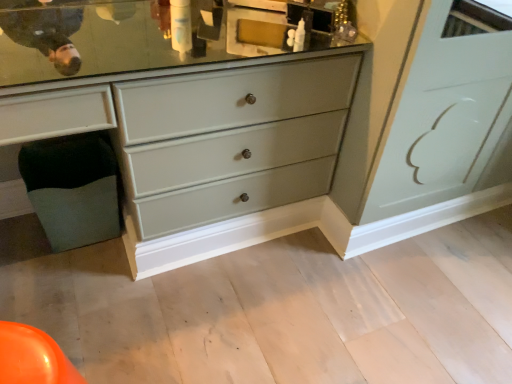
I want to click on satin gray dresser at center, so click(x=295, y=135).

What do you see at coordinates (295, 135) in the screenshot? I see `satin gray dresser at center` at bounding box center [295, 135].

The height and width of the screenshot is (384, 512). Find the location of `satin gray dresser at center`. satin gray dresser at center is located at coordinates (295, 135).